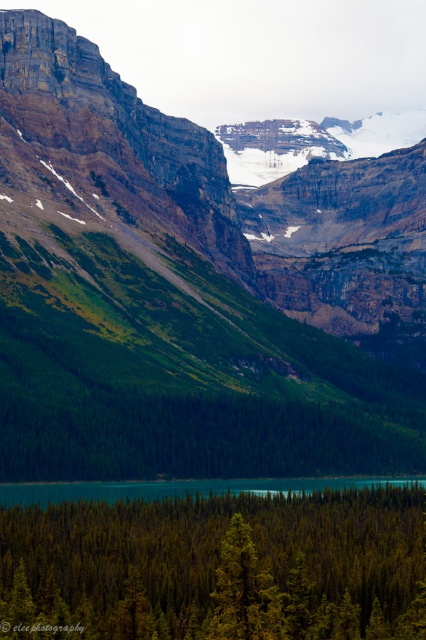
You are an explorer standing at the edge of the forest looking towards the mountains. You see both the green mossy rock at center and the green matte tree at center. Which object is closer to you?

The green mossy rock at center is closer to you because the green matte tree at center is positioned behind it.

You are standing in the forest area of the image and want to walk towards the mountain peaks. You see two points marked on your map. Which point, point (141,540) or point (17,483), is closer to you as you start your hike?

Point (141,540) is closer to the viewer than point (17,483), so you should head towards point (141,540) first as it is nearer to your starting position in the forest.

You are standing at the base of the mountain in the dense forest. You see a point marked at coordinates (216, 566). What object is located at this point?

The point at coordinates (216, 566) indicates a green matte tree at center.